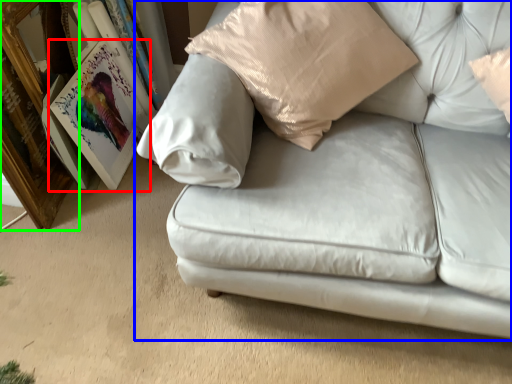
Question: Based on their relative distances, which object is nearer to picture frame (highlighted by a red box)? Choose from studio couch (highlighted by a blue box) and picture frame (highlighted by a green box).

Choices:
 (A) studio couch
 (B) picture frame

Answer: (B)